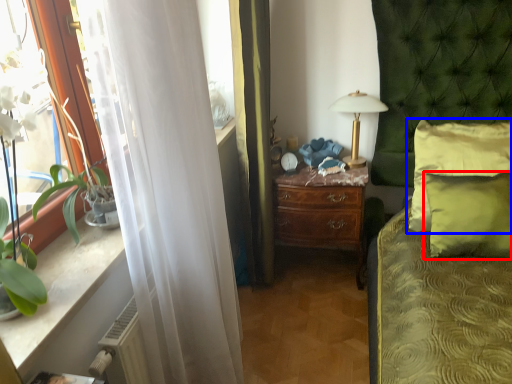
Question: Among these objects, which one is farthest to the camera, pillow (highlighted by a red box) or pillow (highlighted by a blue box)?

Choices:
 (A) pillow
 (B) pillow

Answer: (B)